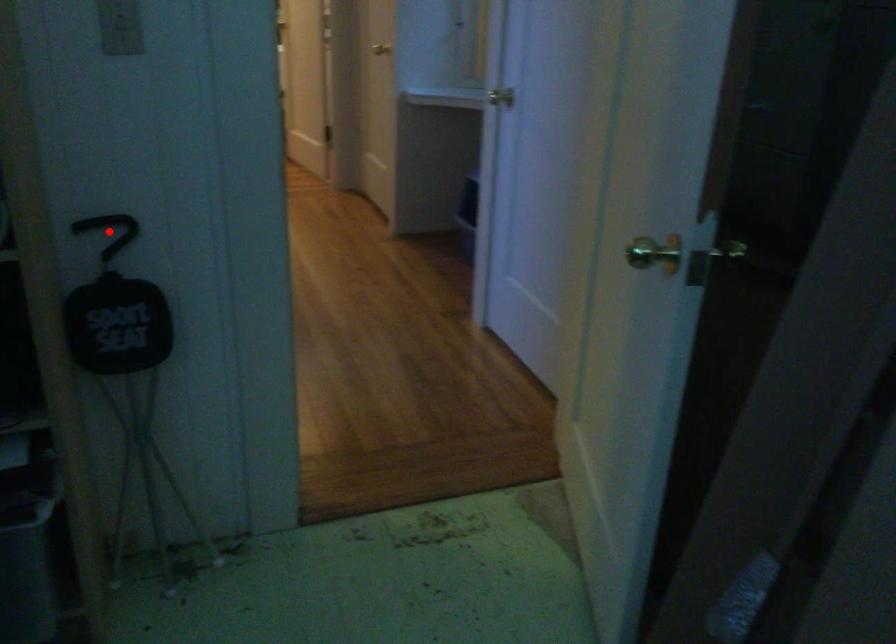
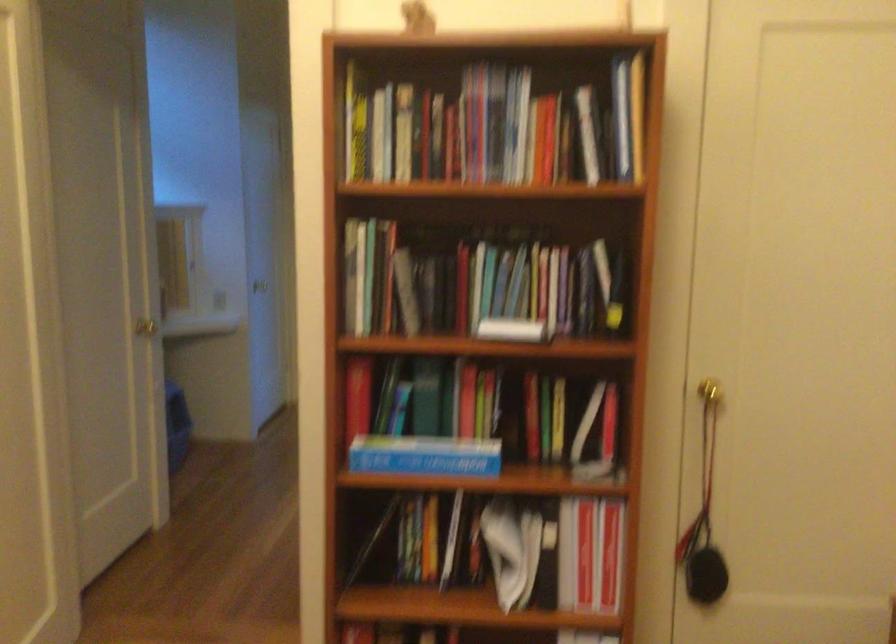
Question: I am providing you with two images of the same scene from different viewpoints. A red point is marked on the first image. Is the red point's position out of view in image 2?

Choices:
 (A) Yes
 (B) No

Answer: (A)